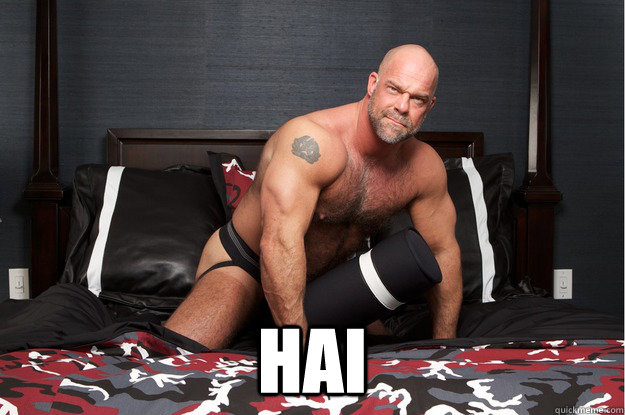
This screenshot has width=625, height=415. Find the location of `wall`. wall is located at coordinates (288, 75).